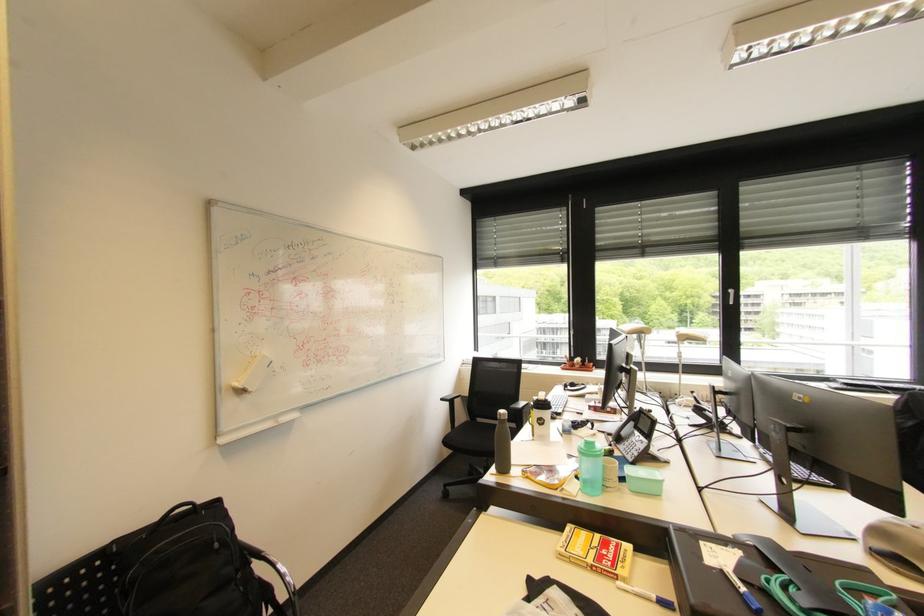
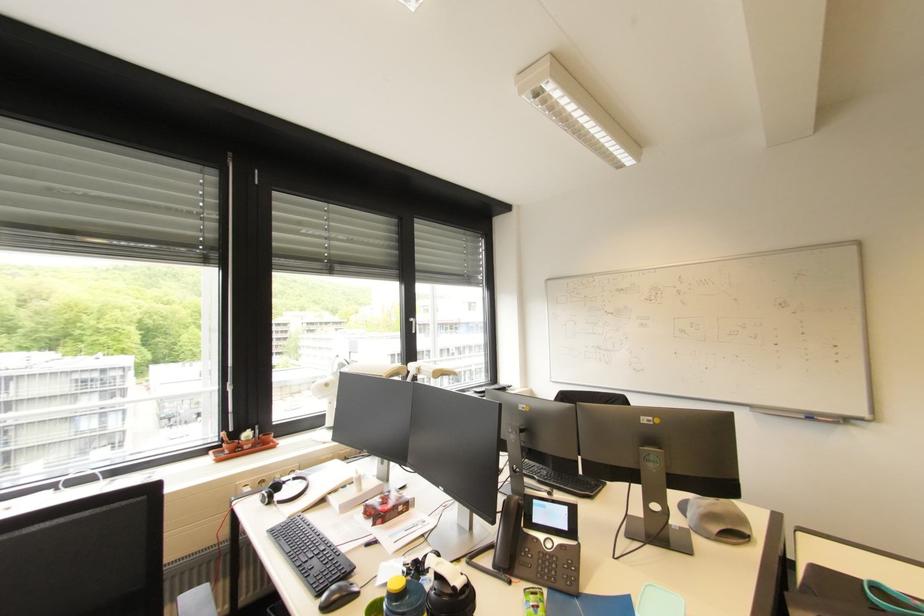
In the second image, find the point that corresponds to (574,389) in the first image.

(283, 498)